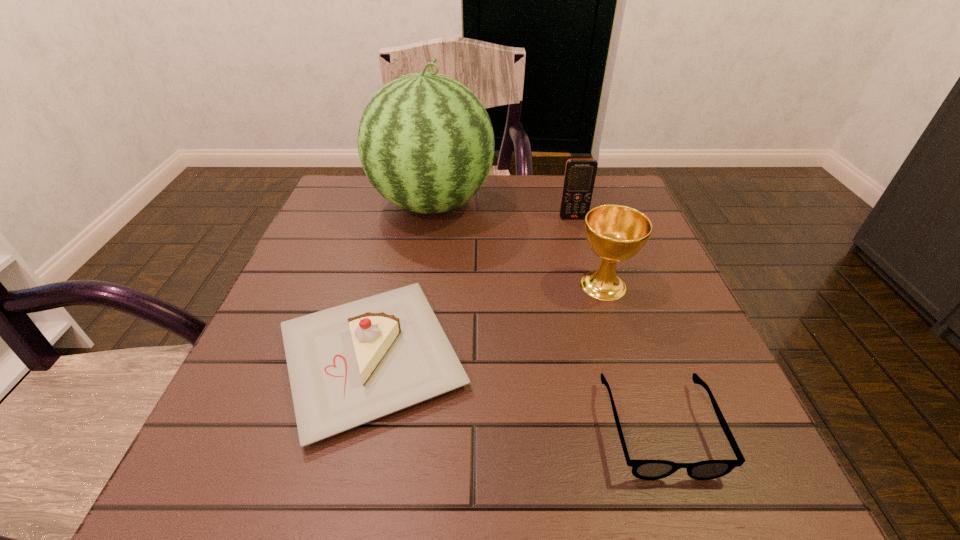
The image size is (960, 540). In order to click on cellular telephone that is at the far edge in this screenshot , I will do `click(580, 174)`.

Identify the location of cake present at the near edge. (348, 365).

The image size is (960, 540). I want to click on spectacles situated at the near edge, so click(x=642, y=469).

The image size is (960, 540). I want to click on watermelon positioned at the left edge, so pos(426,143).

Find the location of `cake present at the left edge`. cake present at the left edge is located at coordinates (348, 365).

I want to click on cellular telephone at the right edge, so click(x=580, y=174).

Locate an element on the screen. The width and height of the screenshot is (960, 540). chalice that is positioned at the right edge is located at coordinates (615, 233).

Where is `spectacles positioned at the right edge`? spectacles positioned at the right edge is located at coordinates (642, 469).

Locate an element on the screen. The height and width of the screenshot is (540, 960). object located at the far left corner is located at coordinates (426, 143).

Where is `object positioned at the near left corner`? object positioned at the near left corner is located at coordinates (348, 365).